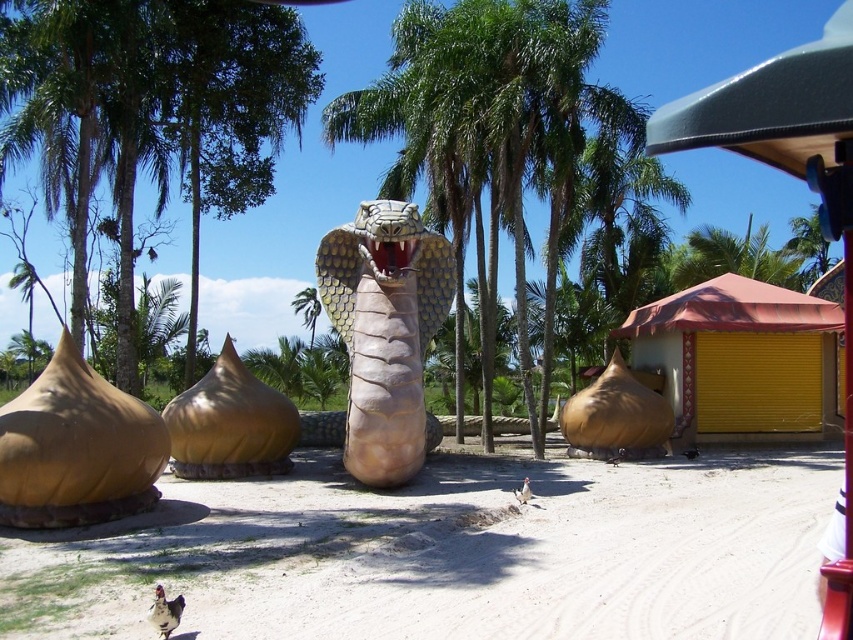
Who is more distant from viewer, (245, 422) or (595, 449)?

The point (595, 449) is more distant.

Is the position of brown matte gourd at center more distant than that of matte gold dome at center?

A: No, it is not.

Locate an element on the screen. This screenshot has height=640, width=853. brown matte gourd at center is located at coordinates (230, 422).

Locate an element on the screen. This screenshot has height=640, width=853. brown matte gourd at center is located at coordinates (230, 422).

Between green leafy palm tree at center and brown matte gourd at center, which one is positioned lower?

brown matte gourd at center is lower down.

The height and width of the screenshot is (640, 853). Find the location of `green leafy palm tree at center`. green leafy palm tree at center is located at coordinates (490, 125).

Who is positioned more to the right, white sandy ground at center or matte gold dome at center?

matte gold dome at center

Is white sandy ground at center shorter than matte gold dome at center?

A: Correct, white sandy ground at center is not as tall as matte gold dome at center.

Is point (802, 472) positioned before point (645, 404)?

That is True.

At what (x,y) coordinates should I click in order to perform the action: click on white sandy ground at center. Please return your answer as a coordinate pair (x, y). Image resolution: width=853 pixels, height=640 pixels. Looking at the image, I should click on (457, 557).